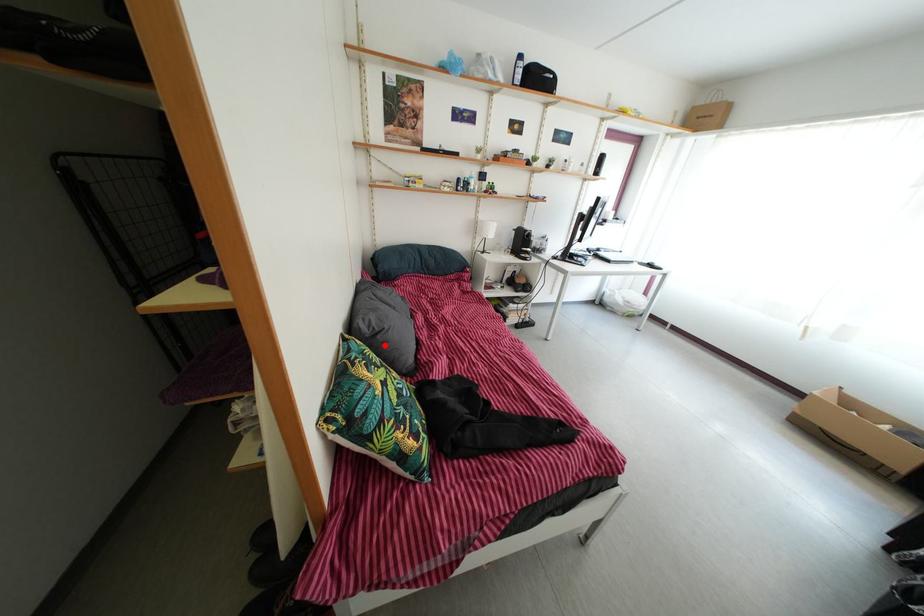
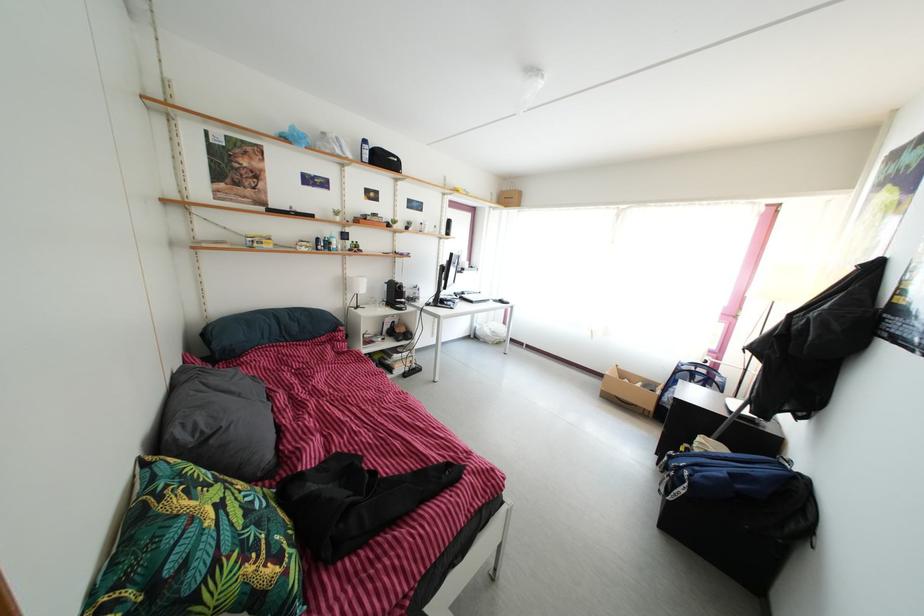
Question: I am providing you with two images of the same scene from different viewpoints. A red point is marked on the first image. At the location where the point appears in image 1, is it still visible in image 2?

Choices:
 (A) Yes
 (B) No

Answer: (A)